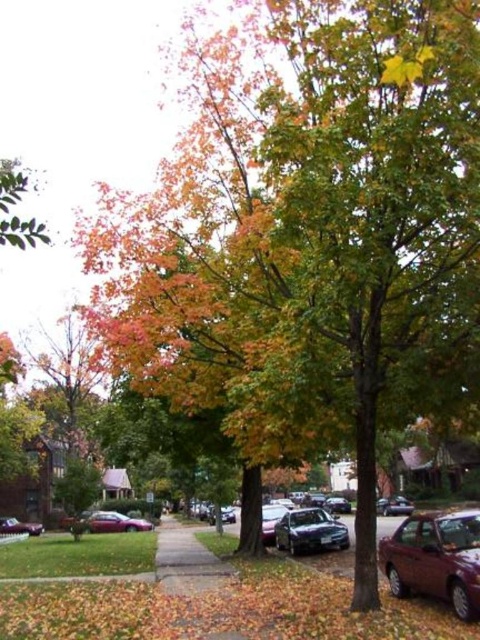
Question: Which object is the closest to the metallic silver sedan at center?

Choices:
 (A) gray concrete sidewalk at center
 (B) shiny silver sedan at lower left
 (C) metallic purple sedan at center

Answer: (A)

Question: Can you confirm if shiny maroon sedan at lower right is thinner than satin black sedan at center?

Choices:
 (A) yes
 (B) no

Answer: (A)

Question: Does shiny silver sedan at center appear over shiny silver sedan at lower left?

Choices:
 (A) no
 (B) yes

Answer: (A)

Question: Is shiny silver sedan at lower left further to camera compared to metallic silver sedan at center?

Choices:
 (A) yes
 (B) no

Answer: (A)

Question: Which point is closer to the camera?

Choices:
 (A) (331, 522)
 (B) (119, 531)

Answer: (A)

Question: Which point appears farthest from the camera in this image?

Choices:
 (A) (167, 552)
 (B) (384, 504)
 (C) (458, 545)

Answer: (B)